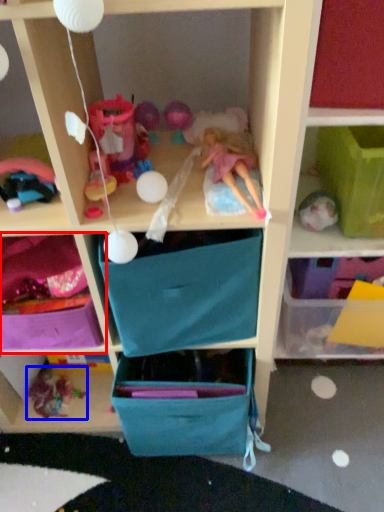
Question: Which of the following is the farthest to the observer, shelf (highlighted by a red box) or toy (highlighted by a blue box)?

Choices:
 (A) shelf
 (B) toy

Answer: (B)